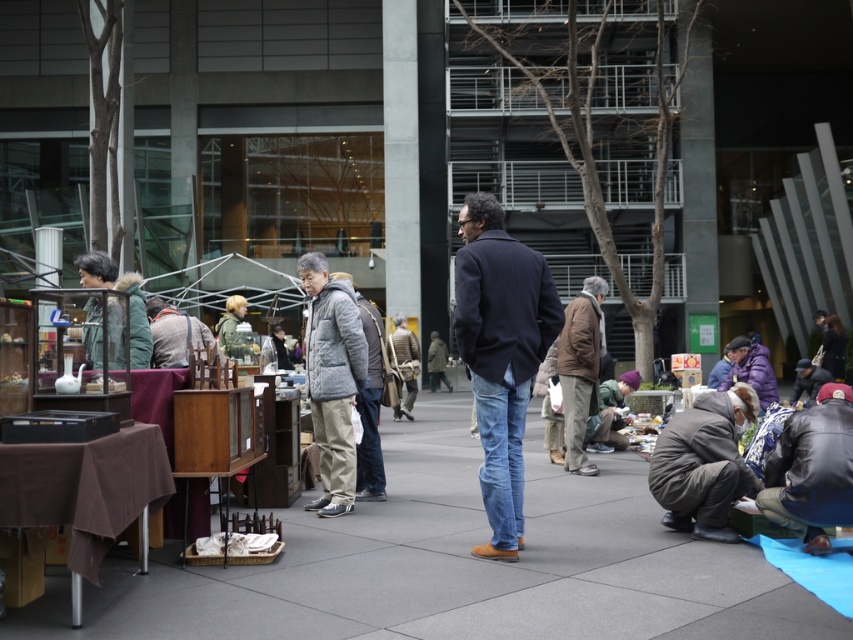
Between gray puffer jacket at center and gray wool jacket at center, which one appears on the left side from the viewer's perspective?

gray wool jacket at center

Does gray puffer jacket at center have a greater height compared to gray wool jacket at center?

Yes.

Measure the distance between gray puffer jacket at center and camera.

gray puffer jacket at center and camera are 25.60 feet apart.

This screenshot has height=640, width=853. In order to click on gray puffer jacket at center in this screenshot , I will do `click(332, 380)`.

Who is positioned more to the left, gray puffer jacket at center or gray woolen jacket at center?

gray puffer jacket at center is more to the left.

Between point (357, 314) and point (370, 436), which one is positioned behind?

Positioned behind is point (370, 436).

The width and height of the screenshot is (853, 640). I want to click on gray puffer jacket at center, so click(332, 380).

Identify the location of gray puffer jacket at center. (332, 380).

Does gray puffer jacket at center appear under purple fuzzy jacket at lower right?

No, gray puffer jacket at center is not below purple fuzzy jacket at lower right.

Is gray puffer jacket at center to the left of purple fuzzy jacket at lower right from the viewer's perspective?

Yes, gray puffer jacket at center is to the left of purple fuzzy jacket at lower right.

Which is behind, point (352, 300) or point (766, 403)?

Point (766, 403)

The height and width of the screenshot is (640, 853). I want to click on gray puffer jacket at center, so click(332, 380).